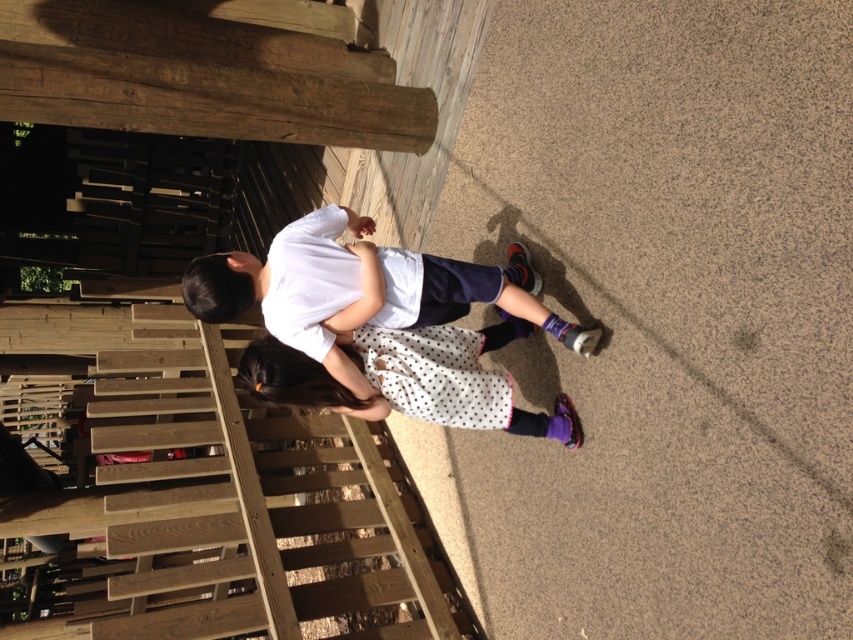
Consider the image. Can you confirm if white matte shirt at center is taller than white dotted dress at center?

Correct, white matte shirt at center is much taller as white dotted dress at center.

Which is below, white matte shirt at center or white dotted dress at center?

white dotted dress at center is below.

I want to click on white matte shirt at center, so click(x=289, y=285).